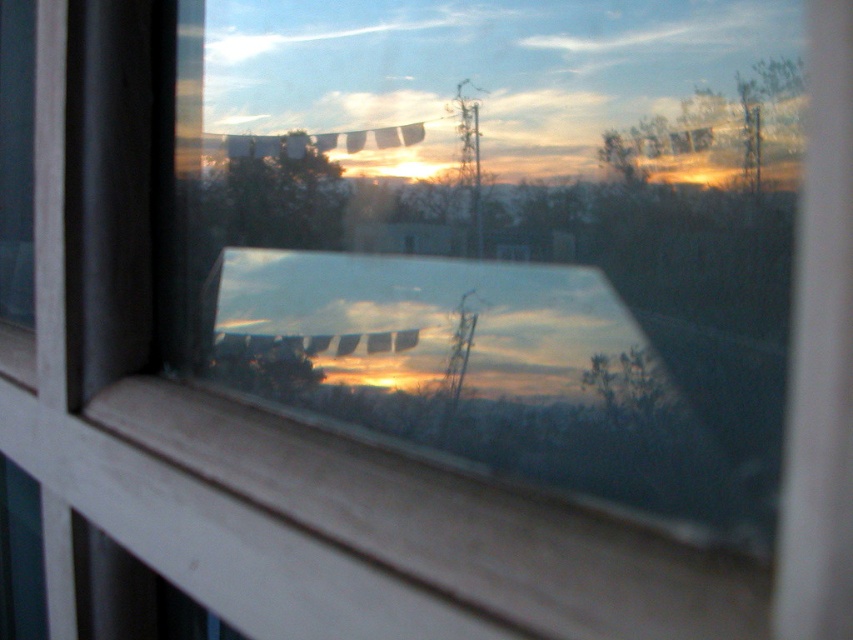
Question: Among these points, which one is nearest to the camera?

Choices:
 (A) (405, 384)
 (B) (294, 189)

Answer: (A)

Question: Is transparent glass train window at center to the right of green matte tree at upper center from the viewer's perspective?

Choices:
 (A) no
 (B) yes

Answer: (B)

Question: Can you confirm if transparent glass train window at center is bigger than green matte tree at upper center?

Choices:
 (A) no
 (B) yes

Answer: (B)

Question: Can you confirm if transparent glass train window at center is positioned to the left of green matte tree at upper center?

Choices:
 (A) no
 (B) yes

Answer: (A)

Question: Among these objects, which one is farthest from the camera?

Choices:
 (A) green matte tree at upper center
 (B) transparent glass train window at center

Answer: (A)